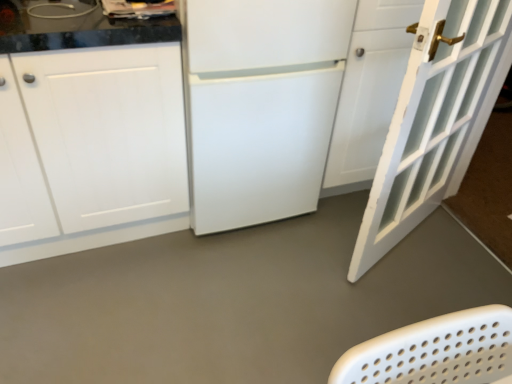
What do you see at coordinates (93, 149) in the screenshot?
I see `white matte cabinet at left` at bounding box center [93, 149].

Describe the element at coordinates (234, 301) in the screenshot. Image resolution: width=512 pixels, height=384 pixels. I see `gray matte floor at center` at that location.

Identify the location of white painted wood door at right. This screenshot has height=384, width=512. (435, 119).

Find the location of a particular element. The image size is (512, 384). white matte refrigerator at center is located at coordinates (260, 105).

Is gray matte floor at center at the back of white painted wood door at right?

No, white painted wood door at right is not facing the opposite direction of gray matte floor at center.

Is white painted wood door at right not near gray matte floor at center?

No.

In order to click on concrete behind the white painted wood door at right in this screenshot , I will do `click(234, 301)`.

In terms of height, does white painted wood door at right look taller or shorter compared to gray matte floor at center?

white painted wood door at right is taller than gray matte floor at center.

Considering the positions of objects white painted wood door at right and white matte cabinet at left in the image provided, who is more to the right, white painted wood door at right or white matte cabinet at left?

white painted wood door at right is more to the right.

From a real-world perspective, between white painted wood door at right and white matte cabinet at left, who is vertically higher?

white painted wood door at right.

Does point (426, 203) appear closer or farther from the camera than point (70, 88)?

Point (426, 203) is farther from the camera than point (70, 88).

Considering the sizes of objects gray matte floor at center and white matte cabinet at left in the image provided, who is smaller, gray matte floor at center or white matte cabinet at left?

gray matte floor at center is smaller.

Is gray matte floor at center to the left of white matte cabinet at left from the viewer's perspective?

In fact, gray matte floor at center is to the right of white matte cabinet at left.

From the image's perspective, is gray matte floor at center under white matte cabinet at left?

Yes.

Which of these two, gray matte floor at center or white matte cabinet at left, is wider?

With larger width is gray matte floor at center.

Relative to white painted wood door at right, is gray matte floor at center in front or behind?

In the image, gray matte floor at center appears behind white painted wood door at right.

Is gray matte floor at center not near white painted wood door at right?

gray matte floor at center is actually quite close to white painted wood door at right.

Is gray matte floor at center taller or shorter than white painted wood door at right?

In the image, gray matte floor at center appears to be shorter than white painted wood door at right.

Considering the positions of point (70, 353) and point (467, 103), is point (70, 353) closer or farther from the camera than point (467, 103)?

Clearly, point (70, 353) is closer to the camera than point (467, 103).

Is white matte cabinet at left directly adjacent to white painted wood door at right?

No, white matte cabinet at left is not in contact with white painted wood door at right.

Which object is closer to the camera, white matte cabinet at left or white painted wood door at right?

white painted wood door at right is in front.

Which is more to the right, white matte cabinet at left or white painted wood door at right?

From the viewer's perspective, white painted wood door at right appears more on the right side.

Considering the positions of objects gray matte floor at center and white matte refrigerator at center in the image provided, who is more to the right, gray matte floor at center or white matte refrigerator at center?

Positioned to the right is gray matte floor at center.

From a real-world perspective, who is located lower, gray matte floor at center or white matte refrigerator at center?

gray matte floor at center is physically lower.

Is gray matte floor at center further to the viewer compared to white matte refrigerator at center?

No, it is not.

Who is shorter, gray matte floor at center or white matte refrigerator at center?

With less height is gray matte floor at center.

Is white matte refrigerator at center oriented towards white painted wood door at right?

No, white matte refrigerator at center is not facing towards white painted wood door at right.

Which is more to the left, white matte refrigerator at center or white painted wood door at right?

From the viewer's perspective, white matte refrigerator at center appears more on the left side.

Considering the sizes of objects white matte refrigerator at center and white painted wood door at right in the image provided, who is taller, white matte refrigerator at center or white painted wood door at right?

white painted wood door at right.

Between white matte refrigerator at center and white painted wood door at right, which one has larger size?

Bigger between the two is white matte refrigerator at center.

Image resolution: width=512 pixels, height=384 pixels. What are the coordinates of `concrete located below the white painted wood door at right (from the image's perspective)` in the screenshot? It's located at (234, 301).

This screenshot has width=512, height=384. In order to click on door in front of the white matte cabinet at left in this screenshot , I will do `click(435, 119)`.

When comparing their distances from gray matte floor at center, does white painted wood door at right or white matte cabinet at left seem further?

white matte cabinet at left is positioned further to the anchor gray matte floor at center.

Estimate the real-world distances between objects in this image. Which object is further from gray matte floor at center, white matte refrigerator at center or white painted wood door at right?

white matte refrigerator at center is further to gray matte floor at center.

When comparing their distances from white painted wood door at right, does white matte cabinet at left or gray matte floor at center seem further?

white matte cabinet at left lies further to white painted wood door at right than the other object.

From the image, which object appears to be nearer to white matte cabinet at left, white painted wood door at right or white matte refrigerator at center?

white matte refrigerator at center is closer to white matte cabinet at left.

From the image, which object appears to be nearer to white matte cabinet at left, white matte refrigerator at center or gray matte floor at center?

Among the two, white matte refrigerator at center is located nearer to white matte cabinet at left.

Estimate the real-world distances between objects in this image. Which object is further from white painted wood door at right, gray matte floor at center or white matte cabinet at left?

Among the two, white matte cabinet at left is located further to white painted wood door at right.

When comparing their distances from gray matte floor at center, does white painted wood door at right or white matte refrigerator at center seem closer?

Based on the image, white painted wood door at right appears to be nearer to gray matte floor at center.

Estimate the real-world distances between objects in this image. Which object is further from gray matte floor at center, white matte cabinet at left or white matte refrigerator at center?

white matte cabinet at left is positioned further to the anchor gray matte floor at center.

Identify the location of refrigerator situated between white matte cabinet at left and gray matte floor at center from left to right. (260, 105).

This screenshot has height=384, width=512. In order to click on refrigerator situated between white matte cabinet at left and white painted wood door at right from left to right in this screenshot , I will do `click(260, 105)`.

Locate an element on the screen. concrete between white matte refrigerator at center and white painted wood door at right in the horizontal direction is located at coordinates (234, 301).

This screenshot has height=384, width=512. I want to click on concrete situated between white matte cabinet at left and white painted wood door at right from left to right, so click(x=234, y=301).